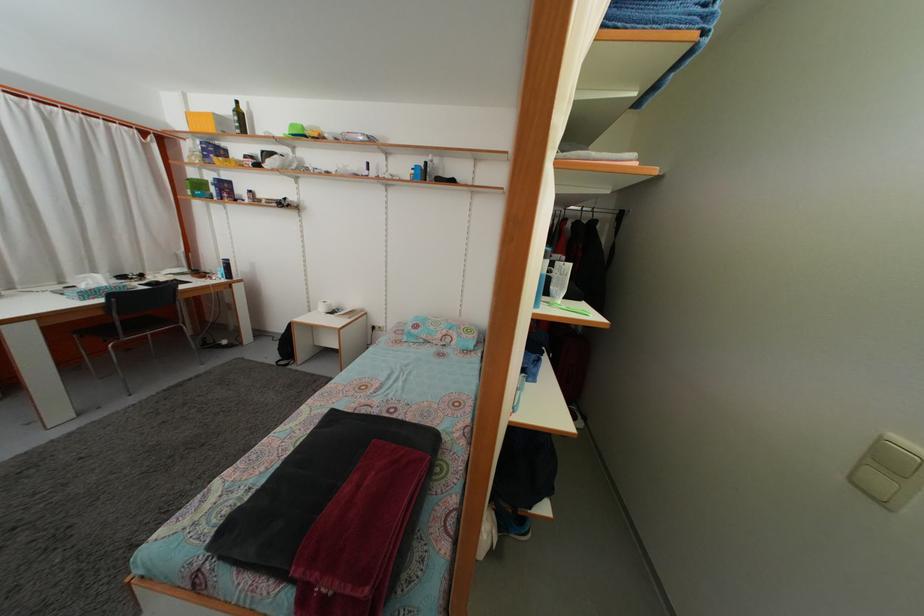
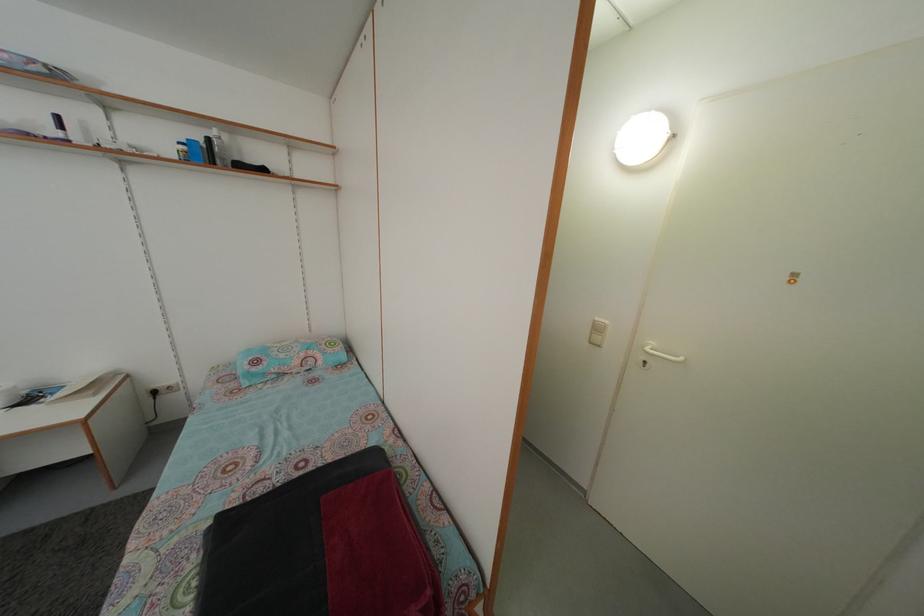
Question: The camera is either moving clockwise (left) or counter-clockwise (right) around the object. The first image is from the beginning of the video and the second image is from the end. Is the camera moving left or right when shooting the video?

Choices:
 (A) Left
 (B) Right

Answer: (A)